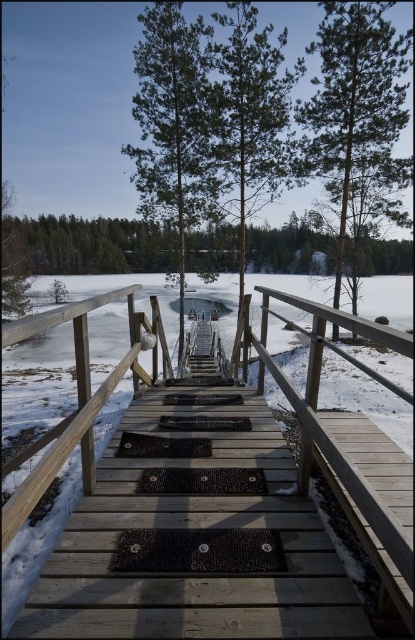
Consider the image. Between green textured pine at center and green matte tree at center, which one is positioned higher?

green matte tree at center is above.

Is green textured pine at center smaller than green matte tree at center?

Incorrect, green textured pine at center is not smaller in size than green matte tree at center.

Identify the location of green textured pine at center. (356, 100).

At what (x,y) coordinates should I click in order to perform the action: click on green textured pine at center. Please return your answer as a coordinate pair (x, y). This screenshot has width=415, height=640. Looking at the image, I should click on (356, 100).

The image size is (415, 640). What do you see at coordinates (192, 528) in the screenshot?
I see `wooden bridge at center` at bounding box center [192, 528].

Measure the distance between wooden bridge at center and camera.

A distance of 1.58 meters exists between wooden bridge at center and camera.

In order to click on wooden bridge at center in this screenshot , I will do `click(192, 528)`.

Is point (336, 48) closer to camera compared to point (175, 204)?

Yes, point (336, 48) is closer to viewer.

Does green textured pine at center appear on the left side of green textured pine tree at center?

Incorrect, green textured pine at center is not on the left side of green textured pine tree at center.

The image size is (415, 640). I want to click on green textured pine at center, so click(356, 100).

Locate an element on the screen. This screenshot has height=640, width=415. green textured pine at center is located at coordinates (356, 100).